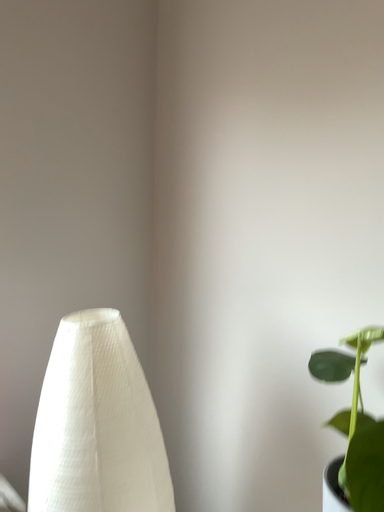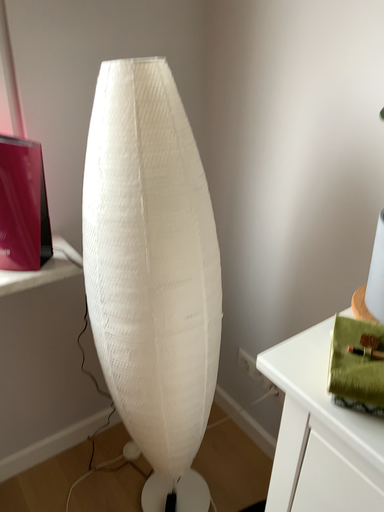
Question: Which way did the camera rotate in the video?

Choices:
 (A) rotated right
 (B) rotated left

Answer: (B)